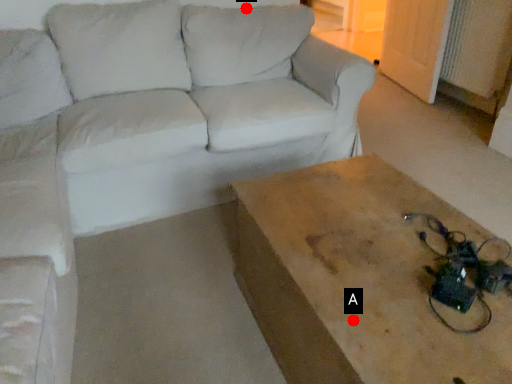
Question: Two points are circled on the image, labeled by A and B beside each circle. Which point appears farthest from the camera in this image?

Choices:
 (A) A is further
 (B) B is further

Answer: (B)